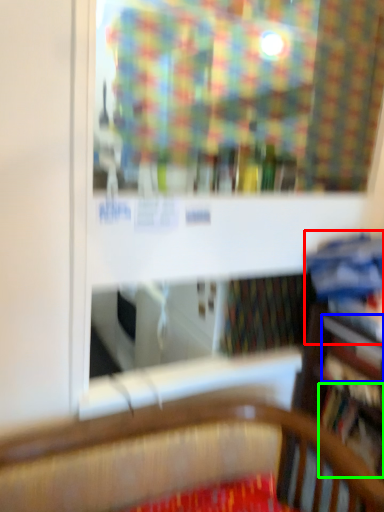
Question: Considering the real-world distances, which object is farthest from book (highlighted by a red box)? book (highlighted by a blue box) or book (highlighted by a green box)?

Choices:
 (A) book
 (B) book

Answer: (B)